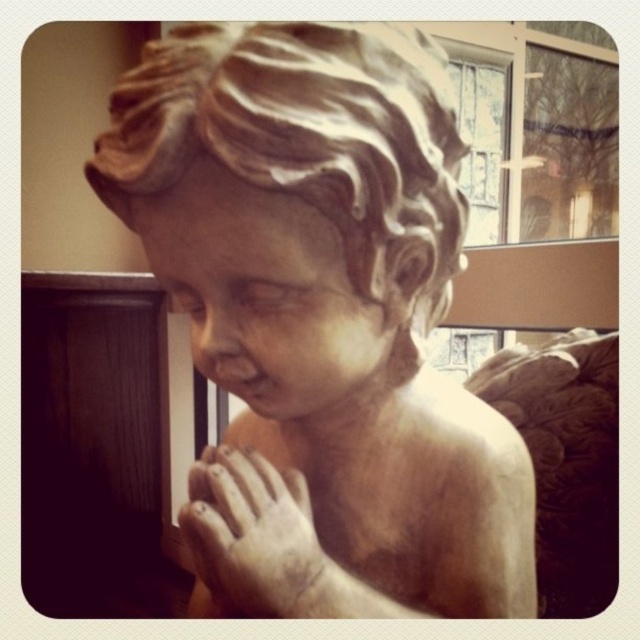
Between matte white statue at center and matte stone hand at center, which one has less height?

matte stone hand at center

Between point (410, 208) and point (266, 605), which one is positioned behind?

Positioned behind is point (266, 605).

You are a GUI agent. You are given a task and a screenshot of the screen. Output one action in this format:
    pyautogui.click(x=<x>, y=<y>)
    Task: Click on the matte white statue at center
    This screenshot has width=640, height=640.
    Given the screenshot: What is the action you would take?
    pyautogui.click(x=321, y=321)